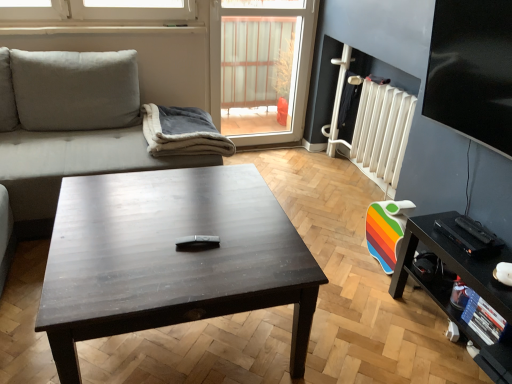
The height and width of the screenshot is (384, 512). Identify the location of transparent glass window screen at upper right, acting as the 1th window screen starting from the front. (472, 70).

Image resolution: width=512 pixels, height=384 pixels. What do you see at coordinates (182, 132) in the screenshot?
I see `gray fleece blanket at center` at bounding box center [182, 132].

You are a GUI agent. You are given a task and a screenshot of the screen. Output one action in this format:
    pyautogui.click(x=<x>, y=<y>)
    Task: Click on the gray fleece blanket at center
    The image size is (512, 384).
    Given the screenshot: What is the action you would take?
    point(182,132)

Locate an element on the screen. The image size is (512, 384). white plastic radiator at right is located at coordinates (382, 133).

Describe the element at coordinates (261, 68) in the screenshot. I see `transparent plastic window screen at upper center, placed as the first window screen when sorted from back to front` at that location.

Identify the location of suede-like beige couch at left. This screenshot has height=384, width=512. (69, 127).

Are black glossy tv stand at lower right and gray fleece blanket at center far apart?

black glossy tv stand at lower right is positioned a significant distance from gray fleece blanket at center.

In the scene shown: Would you say black glossy tv stand at lower right contains gray fleece blanket at center?

No, gray fleece blanket at center is not a part of black glossy tv stand at lower right.

Who is smaller, black glossy tv stand at lower right or gray fleece blanket at center?

gray fleece blanket at center.

From the image's perspective, is black glossy tv stand at lower right beneath gray fleece blanket at center?

Correct, black glossy tv stand at lower right appears lower than gray fleece blanket at center in the image.

From the image's perspective, is dark wood coffee table at center beneath black glossy tv stand at lower right?

No, from the image's perspective, dark wood coffee table at center is not below black glossy tv stand at lower right.

Is dark wood coffee table at center oriented towards black glossy tv stand at lower right?

Yes, dark wood coffee table at center is oriented towards black glossy tv stand at lower right.

Is dark wood coffee table at center far away from black glossy tv stand at lower right?

That's not correct — dark wood coffee table at center is a little close to black glossy tv stand at lower right.

From a real-world perspective, which is physically above, dark wood coffee table at center or black glossy tv stand at lower right?

From a 3D spatial view, dark wood coffee table at center is above.

From a real-world perspective, which object stands above the other?

transparent glass window screen at upper right, which is the 1th window screen from right to left.

From the picture: Does suede-like beige couch at left contain transparent glass window screen at upper right, which is the 1th window screen from right to left?

No, transparent glass window screen at upper right, which is the 1th window screen from right to left, is not inside suede-like beige couch at left.

Can you tell me how much suede-like beige couch at left and transparent glass window screen at upper right, acting as the 1th window screen starting from the front, differ in facing direction?

The facing directions of suede-like beige couch at left and transparent glass window screen at upper right, acting as the 1th window screen starting from the front, are 89.1 degrees apart.

Considering the points (15, 221) and (451, 124), which point is behind, point (15, 221) or point (451, 124)?

The point (15, 221) is more distant.

Does black glossy tv stand at lower right have a larger size compared to suede-like beige couch at left?

No, black glossy tv stand at lower right is not bigger than suede-like beige couch at left.

Between black glossy tv stand at lower right and suede-like beige couch at left, which one has less height?

Standing shorter between the two is black glossy tv stand at lower right.

Which point is more distant from viewer, (462, 272) or (25, 130)?

Point (25, 130)

Which object is positioned more to the right, transparent glass window screen at upper right, the 2th window screen viewed from the left, or transparent plastic window screen at upper center, placed as the 2th window screen when sorted from right to left?

transparent glass window screen at upper right, the 2th window screen viewed from the left.

From a real-world perspective, is transparent glass window screen at upper right, which ranks as the second window screen in back-to-front order, over transparent plastic window screen at upper center, which appears as the 1th window screen when viewed from the left?

Yes, from a real-world perspective, transparent glass window screen at upper right, which ranks as the second window screen in back-to-front order, is above transparent plastic window screen at upper center, which appears as the 1th window screen when viewed from the left.

Which point is more forward, (456, 115) or (241, 77)?

The point (456, 115) is closer.

Locate an element on the screen. The width and height of the screenshot is (512, 384). window screen located above the transparent plastic window screen at upper center, which appears as the 1th window screen when viewed from the left (from a real-world perspective) is located at coordinates (x=472, y=70).

Is gray fleece blanket at center inside the boundaries of transparent plastic window screen at upper center, placed as the 2th window screen when sorted from right to left, or outside?

gray fleece blanket at center cannot be found inside transparent plastic window screen at upper center, placed as the 2th window screen when sorted from right to left.

From the image's perspective, which is below, gray fleece blanket at center or transparent plastic window screen at upper center, placed as the first window screen when sorted from back to front?

gray fleece blanket at center, from the image's perspective.

In the scene shown: Is gray fleece blanket at center further to camera compared to transparent plastic window screen at upper center, marked as the 2th window screen in a front-to-back arrangement?

No, it is in front of transparent plastic window screen at upper center, marked as the 2th window screen in a front-to-back arrangement.

Is gray fleece blanket at center facing away from transparent plastic window screen at upper center, which appears as the 1th window screen when viewed from the left?

gray fleece blanket at center is not turned away from transparent plastic window screen at upper center, which appears as the 1th window screen when viewed from the left.

From a real-world perspective, does suede-like beige couch at left stand above gray fleece blanket at center?

No.

Which is correct: suede-like beige couch at left is inside gray fleece blanket at center, or outside of it?

suede-like beige couch at left is located beyond the bounds of gray fleece blanket at center.

Is suede-like beige couch at left oriented away from gray fleece blanket at center?

suede-like beige couch at left is not turned away from gray fleece blanket at center.

Where is `blanket above the black glossy tv stand at lower right (from a real-world perspective)`? This screenshot has width=512, height=384. blanket above the black glossy tv stand at lower right (from a real-world perspective) is located at coordinates (182, 132).

The width and height of the screenshot is (512, 384). In order to click on coffee table located on the left of black glossy tv stand at lower right in this screenshot , I will do `click(170, 258)`.

Which object lies further to the anchor point transparent glass window screen at upper right, acting as the 1th window screen starting from the front, transparent plastic window screen at upper center, placed as the 2th window screen when sorted from right to left, or black glossy tv stand at lower right?

transparent plastic window screen at upper center, placed as the 2th window screen when sorted from right to left.

Considering their positions, is transparent plastic window screen at upper center, placed as the 2th window screen when sorted from right to left, positioned closer to black glossy tv stand at lower right than dark wood coffee table at center?

dark wood coffee table at center is closer to black glossy tv stand at lower right.

From the image, which object appears to be nearer to transparent glass window screen at upper right, which is the 1th window screen from right to left, gray fleece blanket at center or white plastic radiator at right?

Based on the image, white plastic radiator at right appears to be nearer to transparent glass window screen at upper right, which is the 1th window screen from right to left.

Considering their positions, is white plastic radiator at right positioned further to suede-like beige couch at left than gray fleece blanket at center?

Among the two, white plastic radiator at right is located further to suede-like beige couch at left.

From the image, which object appears to be nearer to transparent plastic window screen at upper center, marked as the 2th window screen in a front-to-back arrangement, black glossy tv stand at lower right or transparent glass window screen at upper right, the 2th window screen viewed from the left?

Based on the image, transparent glass window screen at upper right, the 2th window screen viewed from the left, appears to be nearer to transparent plastic window screen at upper center, marked as the 2th window screen in a front-to-back arrangement.

Considering their positions, is suede-like beige couch at left positioned further to transparent glass window screen at upper right, acting as the 1th window screen starting from the front, than gray fleece blanket at center?

Among the two, suede-like beige couch at left is located further to transparent glass window screen at upper right, acting as the 1th window screen starting from the front.

Looking at this image, estimate the real-world distances between objects in this image. Which object is further from transparent plastic window screen at upper center, which appears as the 1th window screen when viewed from the left, white plastic radiator at right or dark wood coffee table at center?

dark wood coffee table at center lies further to transparent plastic window screen at upper center, which appears as the 1th window screen when viewed from the left, than the other object.

Based on their spatial positions, is gray fleece blanket at center or black glossy tv stand at lower right further from white plastic radiator at right?

Among the two, gray fleece blanket at center is located further to white plastic radiator at right.

Image resolution: width=512 pixels, height=384 pixels. In order to click on table located between dark wood coffee table at center and transparent plastic window screen at upper center, placed as the first window screen when sorted from back to front, in the depth direction in this screenshot , I will do `click(463, 280)`.

The height and width of the screenshot is (384, 512). Identify the location of coffee table between gray fleece blanket at center and black glossy tv stand at lower right from left to right. (170, 258).

Where is `coffee table situated between suede-like beige couch at left and black glossy tv stand at lower right from left to right`? The width and height of the screenshot is (512, 384). coffee table situated between suede-like beige couch at left and black glossy tv stand at lower right from left to right is located at coordinates (170, 258).

Identify the location of studio couch between dark wood coffee table at center and gray fleece blanket at center from front to back. The image size is (512, 384). (69, 127).